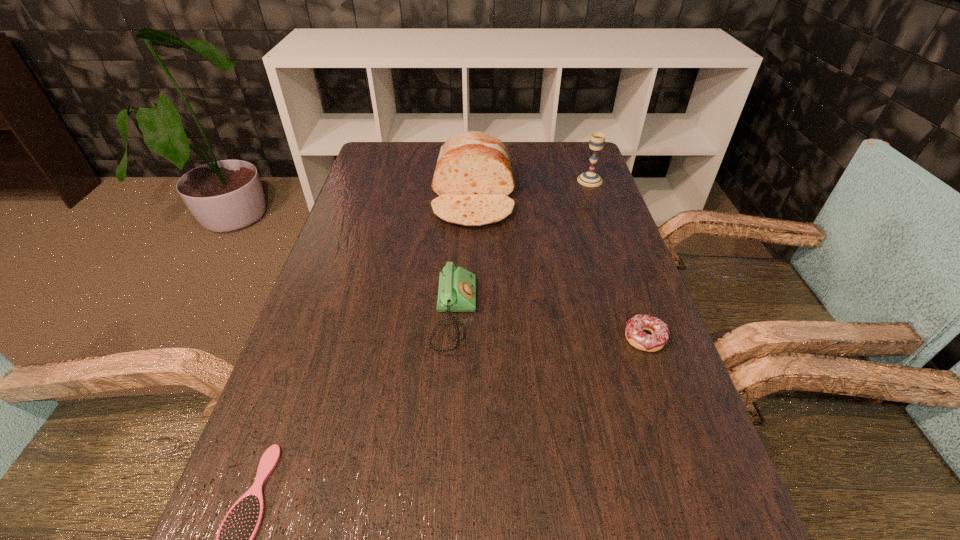
Find the location of a particular element. This screenshot has height=540, width=960. vacant point that satisfies the following two spatial constraints: 1. on the back side of the second shortest object; 2. on the dial of the third tallest object is located at coordinates (636, 315).